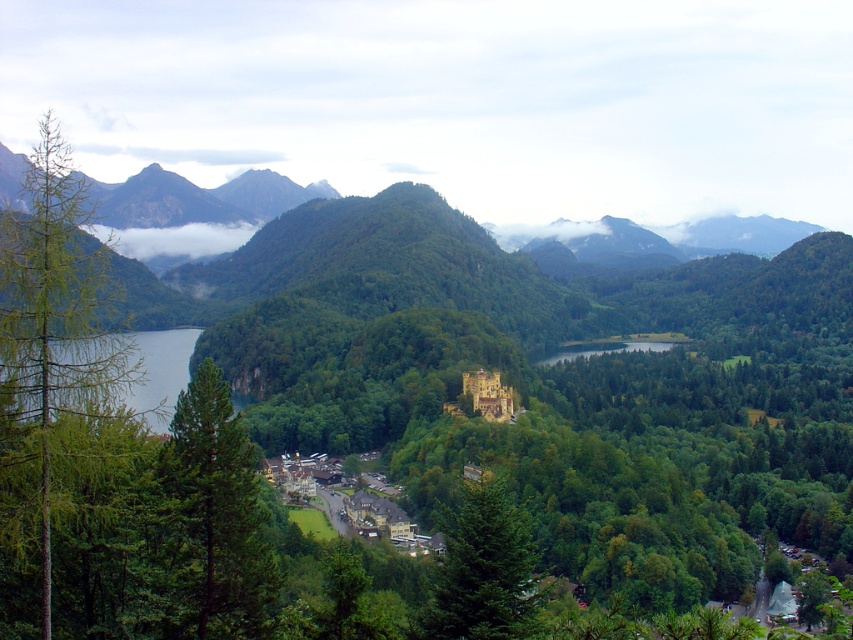
Is green needle-like tree at left closer to camera compared to green textured tree at center?

Yes.

I want to click on green needle-like tree at left, so click(50, 342).

This screenshot has height=640, width=853. Find the location of `green needle-like tree at left`. green needle-like tree at left is located at coordinates (50, 342).

Who is more forward, (x=20, y=285) or (x=218, y=472)?

Point (x=20, y=285)

Does point (56, 310) come in front of point (209, 365)?

Yes, it is in front of point (209, 365).

Locate an element on the screen. green needle-like tree at left is located at coordinates (50, 342).

Can you confirm if green textured tree at center is shorter than brown wooden houses at center?

No, green textured tree at center is not shorter than brown wooden houses at center.

Does green textured tree at center have a smaller size compared to brown wooden houses at center?

Indeed, green textured tree at center has a smaller size compared to brown wooden houses at center.

Identify the location of green textured tree at center. This screenshot has width=853, height=640. (482, 570).

Locate an element on the screen. The height and width of the screenshot is (640, 853). green textured tree at center is located at coordinates (482, 570).